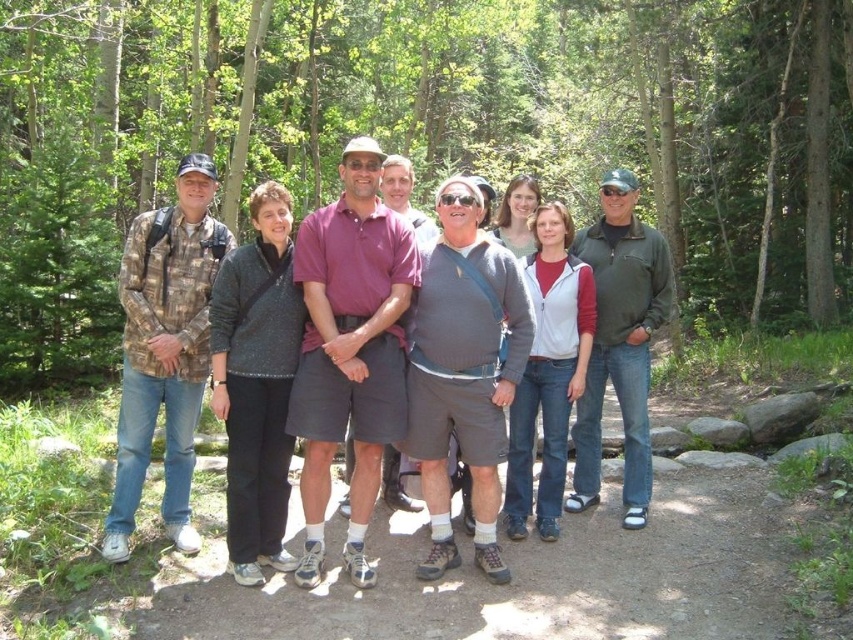
Question: Is green leafy trees at center to the right of camouflage fabric shirt at left from the viewer's perspective?

Choices:
 (A) yes
 (B) no

Answer: (A)

Question: Which point is closer to the camera?

Choices:
 (A) (399, 243)
 (B) (538, 152)

Answer: (A)

Question: Does green leafy trees at center appear on the left side of camouflage fabric shirt at left?

Choices:
 (A) no
 (B) yes

Answer: (A)

Question: Is green leafy trees at center below camouflage fabric shirt at left?

Choices:
 (A) no
 (B) yes

Answer: (A)

Question: Which point is closer to the camera?

Choices:
 (A) green leafy trees at center
 (B) camouflage fabric shirt at left

Answer: (B)